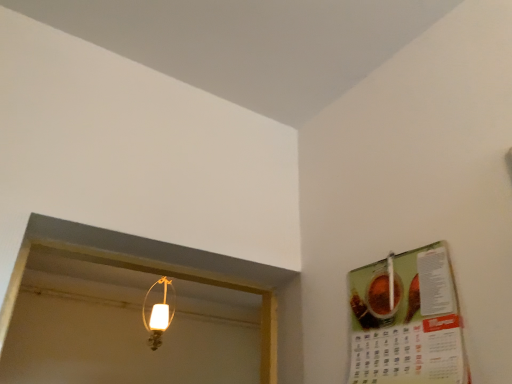
Measure the distance between point (155,346) and camera.

The distance of point (155,346) from camera is 8.39 feet.

Image resolution: width=512 pixels, height=384 pixels. Identify the location of matte glass lampshade at upper center. (158, 315).

The width and height of the screenshot is (512, 384). Describe the element at coordinates (158, 315) in the screenshot. I see `matte glass lampshade at upper center` at that location.

What are the coordinates of `green matte calendar at upper right` in the screenshot? It's located at (x=406, y=321).

From the picture: Measure the distance between green matte calendar at upper right and camera.

green matte calendar at upper right and camera are 34.87 inches apart.

What do you see at coordinates (406, 321) in the screenshot? I see `green matte calendar at upper right` at bounding box center [406, 321].

I want to click on matte glass lampshade at upper center, so click(x=158, y=315).

Considering the positions of objects matte glass lampshade at upper center and green matte calendar at upper right in the image provided, who is more to the left, matte glass lampshade at upper center or green matte calendar at upper right?

Positioned to the left is matte glass lampshade at upper center.

Which is in front, matte glass lampshade at upper center or green matte calendar at upper right?

green matte calendar at upper right is closer to the camera.

Is point (174, 309) positioned before point (376, 269)?

No, (174, 309) is further to viewer.

From the image's perspective, between matte glass lampshade at upper center and green matte calendar at upper right, who is located below?

From the image's view, matte glass lampshade at upper center is below.

From a real-world perspective, is matte glass lampshade at upper center physically above green matte calendar at upper right?

Yes, from a real-world perspective, matte glass lampshade at upper center is over green matte calendar at upper right

Considering the relative sizes of matte glass lampshade at upper center and green matte calendar at upper right in the image provided, is matte glass lampshade at upper center thinner than green matte calendar at upper right?

Incorrect, the width of matte glass lampshade at upper center is not less than that of green matte calendar at upper right.

Considering the sizes of objects matte glass lampshade at upper center and green matte calendar at upper right in the image provided, who is shorter, matte glass lampshade at upper center or green matte calendar at upper right?

green matte calendar at upper right is shorter.

Considering the relative sizes of matte glass lampshade at upper center and green matte calendar at upper right in the image provided, is matte glass lampshade at upper center bigger than green matte calendar at upper right?

Indeed, matte glass lampshade at upper center has a larger size compared to green matte calendar at upper right.

In the scene shown: Is green matte calendar at upper right surrounded by matte glass lampshade at upper center?

That's incorrect, green matte calendar at upper right is not inside matte glass lampshade at upper center.

Are matte glass lampshade at upper center and green matte calendar at upper right beside each other?

No, matte glass lampshade at upper center is not in contact with green matte calendar at upper right.

Is matte glass lampshade at upper center facing away from green matte calendar at upper right?

No, green matte calendar at upper right is not at the back of matte glass lampshade at upper center.

Where is `lamp located below the green matte calendar at upper right (from the image's perspective)`? The width and height of the screenshot is (512, 384). lamp located below the green matte calendar at upper right (from the image's perspective) is located at coordinates (158, 315).

Considering the positions of objects green matte calendar at upper right and matte glass lampshade at upper center in the image provided, who is more to the right, green matte calendar at upper right or matte glass lampshade at upper center?

green matte calendar at upper right.

Which object is more forward, green matte calendar at upper right or matte glass lampshade at upper center?

Positioned in front is green matte calendar at upper right.

Considering the points (434, 286) and (159, 324), which point is in front, point (434, 286) or point (159, 324)?

Positioned in front is point (434, 286).

Looking at this image, from the image's perspective, relative to matte glass lampshade at upper center, is green matte calendar at upper right above or below?

Clearly, from the image's perspective, green matte calendar at upper right is above matte glass lampshade at upper center.

From a real-world perspective, is green matte calendar at upper right located higher than matte glass lampshade at upper center?

Incorrect, from a real-world perspective, green matte calendar at upper right is lower than matte glass lampshade at upper center.

Can you confirm if green matte calendar at upper right is wider than matte glass lampshade at upper center?

Incorrect, the width of green matte calendar at upper right does not surpass that of matte glass lampshade at upper center.

Is green matte calendar at upper right taller or shorter than matte glass lampshade at upper center?

Considering their sizes, green matte calendar at upper right has less height than matte glass lampshade at upper center.

Looking at the image, does green matte calendar at upper right seem bigger or smaller compared to matte glass lampshade at upper center?

green matte calendar at upper right is smaller than matte glass lampshade at upper center.

Is green matte calendar at upper right spatially inside matte glass lampshade at upper center, or outside of it?

green matte calendar at upper right is not inside matte glass lampshade at upper center, it's outside.

Is there a large distance between green matte calendar at upper right and matte glass lampshade at upper center?

Yes, green matte calendar at upper right is far from matte glass lampshade at upper center.

Is green matte calendar at upper right facing towards matte glass lampshade at upper center?

No.

Can you tell me how much green matte calendar at upper right and matte glass lampshade at upper center differ in facing direction?

92.5 degrees.

Measure the distance from green matte calendar at upper right to matte glass lampshade at upper center.

The distance of green matte calendar at upper right from matte glass lampshade at upper center is 1.58 meters.

Identify the location of lamp below the green matte calendar at upper right (from the image's perspective). This screenshot has height=384, width=512. (158, 315).

Identify the location of lamp behind the green matte calendar at upper right. The width and height of the screenshot is (512, 384). (158, 315).

You are a GUI agent. You are given a task and a screenshot of the screen. Output one action in this format:
    pyautogui.click(x=<x>, y=<y>)
    Task: Click on the menu in front of the matte glass lampshade at upper center
    The image size is (512, 384).
    Given the screenshot: What is the action you would take?
    406,321